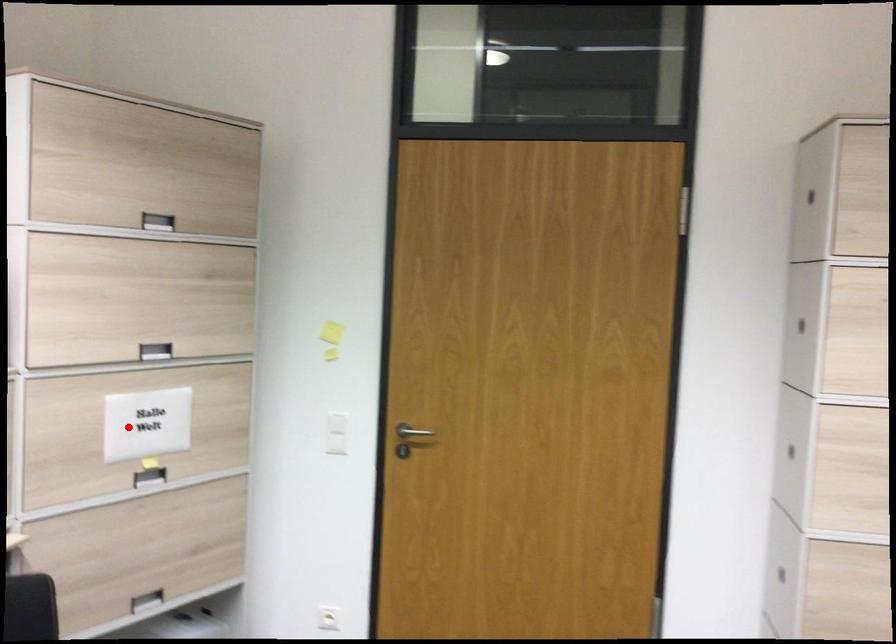
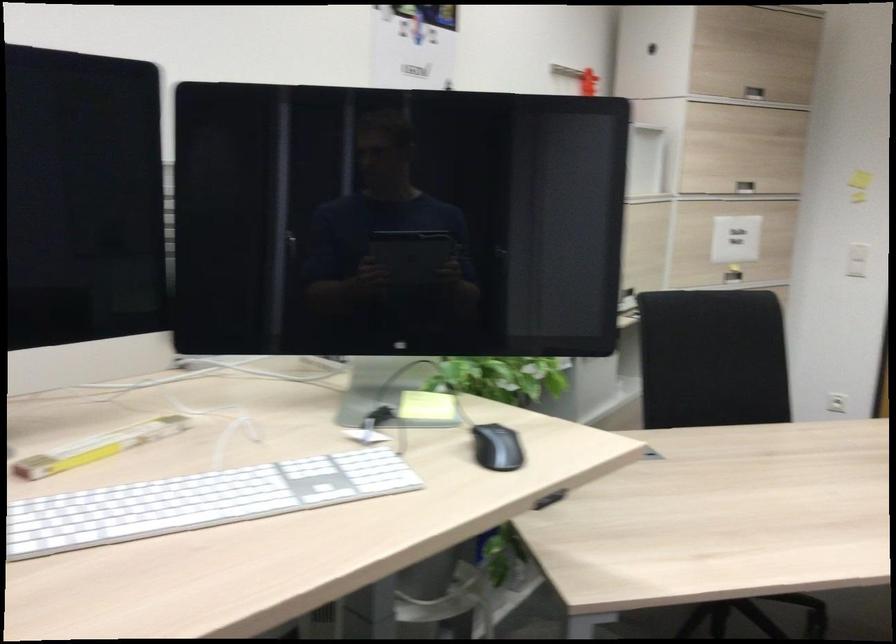
Question: A red point is marked in image1. In image2, is the corresponding 3D point closer to the camera or farther? Reply with the corresponding letter.

Choices:
 (A) The corresponding 3D point is closer.
 (B) The corresponding 3D point is farther.

Answer: (B)